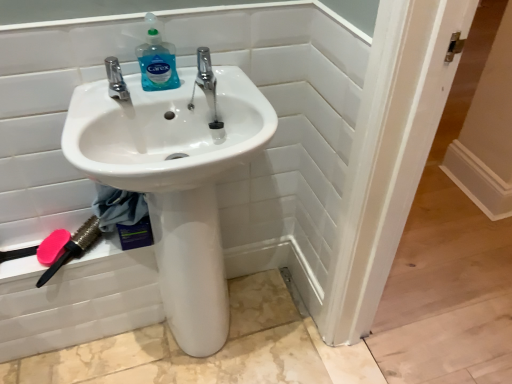
The width and height of the screenshot is (512, 384). Identify the location of vacant space in white glossy sink at center (from a real-world perspective). (227, 333).